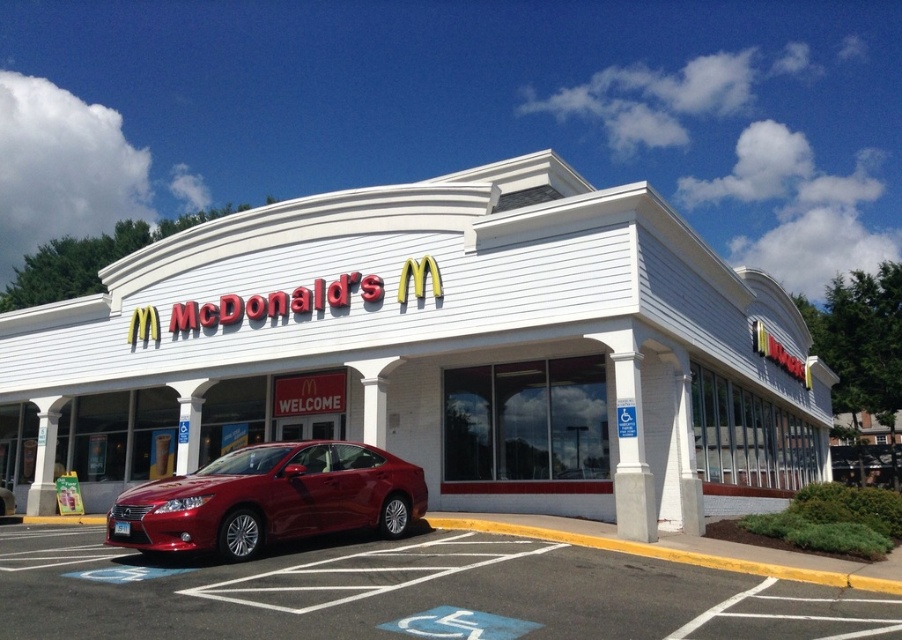
Question: Which point is farther from the camera taking this photo?

Choices:
 (A) (170, 522)
 (B) (481, 548)
 (C) (627, 483)

Answer: (C)

Question: Which point is farther to the camera?

Choices:
 (A) (357, 452)
 (B) (808, 628)
 (C) (308, 224)

Answer: (C)

Question: Considering the relative positions of smooth asphalt parking lot at lower center and glossy metallic sedan at center in the image provided, where is smooth asphalt parking lot at lower center located with respect to glossy metallic sedan at center?

Choices:
 (A) right
 (B) left

Answer: (A)

Question: Which object is positioned farthest from the smooth asphalt parking lot at lower center?

Choices:
 (A) glossy metallic sedan at center
 (B) white siding mcdonald's at center

Answer: (B)

Question: Can you confirm if white siding mcdonald's at center is positioned above glossy metallic sedan at center?

Choices:
 (A) no
 (B) yes

Answer: (B)

Question: Can you confirm if white siding mcdonald's at center is positioned above smooth asphalt parking lot at lower center?

Choices:
 (A) yes
 (B) no

Answer: (A)